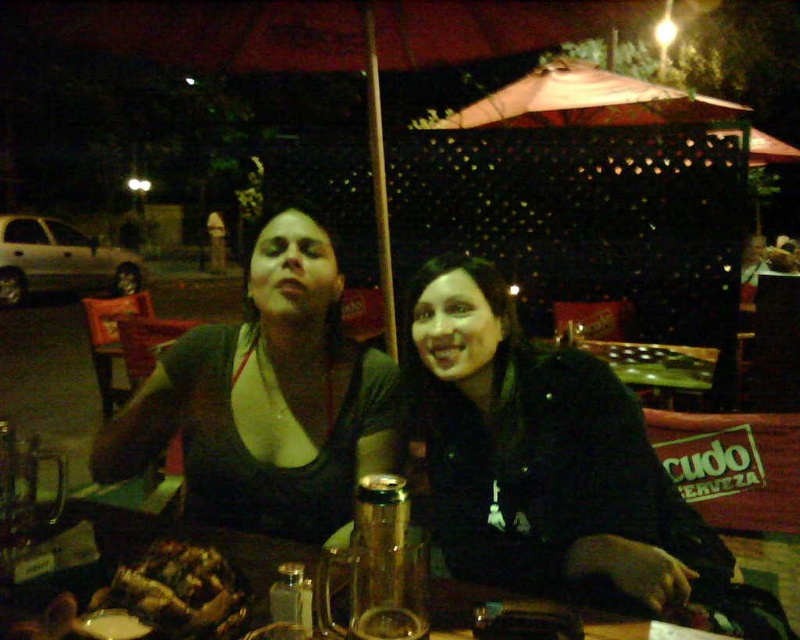
You are a delivery person who needs to place a small package between the black matte jacket at center and the brown crispy chicken at lower left. Can you fit the package there?

The black matte jacket at center is larger than the brown crispy chicken at lower left, so there might be enough space between them to fit a small package.

You are a photographer trying to capture a candid shot of the black matte jacket at center. What are the coordinates where you should focus your camera?

The coordinates for the black matte jacket at center are at point [542,458].